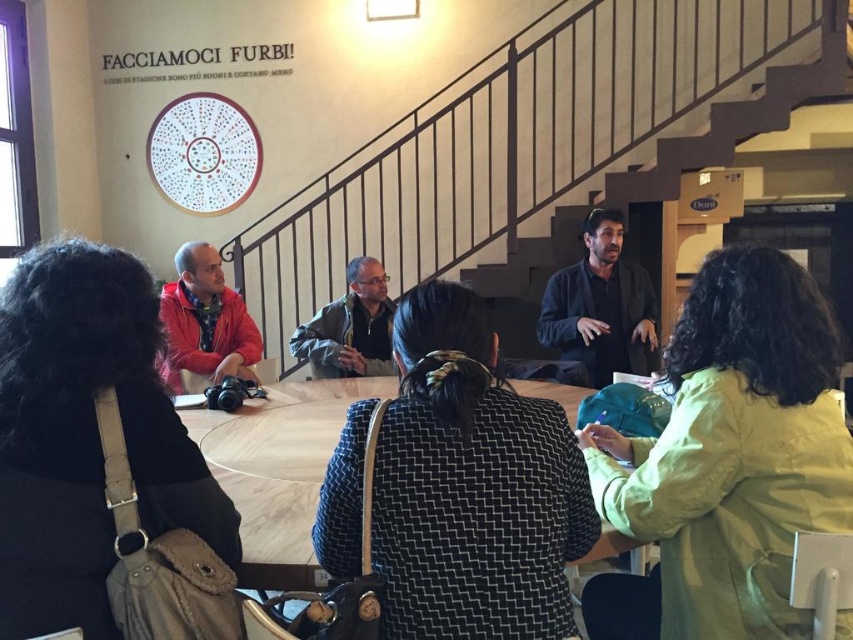
You are a person who is 5 feet tall. You need to reach a book that is on a shelf 10 feet above the ground. There is a black textured jacket at center and a wooden staircase at center in the room. Can you use either of these objects to reach the book?

The black textured jacket at center is 11.02 feet from the wooden staircase at center. Since the staircase is at center, it might be positioned in a way that allows you to climb it to reach the 10 feet high shelf. The jacket is not helpful for reaching heights. Therefore, you can use the wooden staircase at center to reach the book.

You are a visitor in the museum and you see the red jacket at left and the wooden staircase at center. Which object is smaller in size?

The red jacket at left is smaller in size compared to the wooden staircase at center.